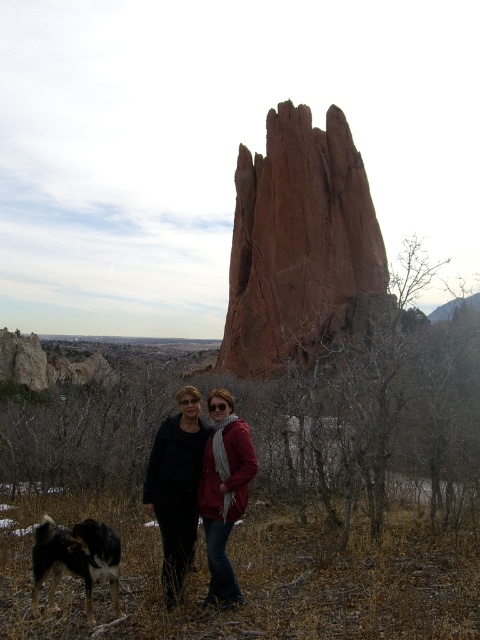
Can you confirm if matte black jacket at center is taller than black and white fur at lower left?

Correct, matte black jacket at center is much taller as black and white fur at lower left.

Is matte black jacket at center positioned behind black and white fur at lower left?

That is True.

Is point (167, 595) positioned before point (86, 593)?

No.

This screenshot has width=480, height=640. I want to click on matte black jacket at center, so click(177, 484).

Between reddish-brown rock at center and black and white fur at lower left, which one appears on the left side from the viewer's perspective?

black and white fur at lower left is more to the left.

Is reddish-brown rock at center positioned at the back of black and white fur at lower left?

Yes, reddish-brown rock at center is behind black and white fur at lower left.

At what (x,y) coordinates should I click in order to perform the action: click on reddish-brown rock at center. Please return your answer as a coordinate pair (x, y). The width and height of the screenshot is (480, 640). Looking at the image, I should click on (301, 246).

Is matte red jacket at center positioned before black and white fur at lower left?

No.

Does point (223, 486) lie in front of point (84, 557)?

No.

Between point (243, 474) and point (81, 538), which one is positioned in front?

Point (81, 538)

This screenshot has width=480, height=640. I want to click on matte red jacket at center, so click(224, 492).